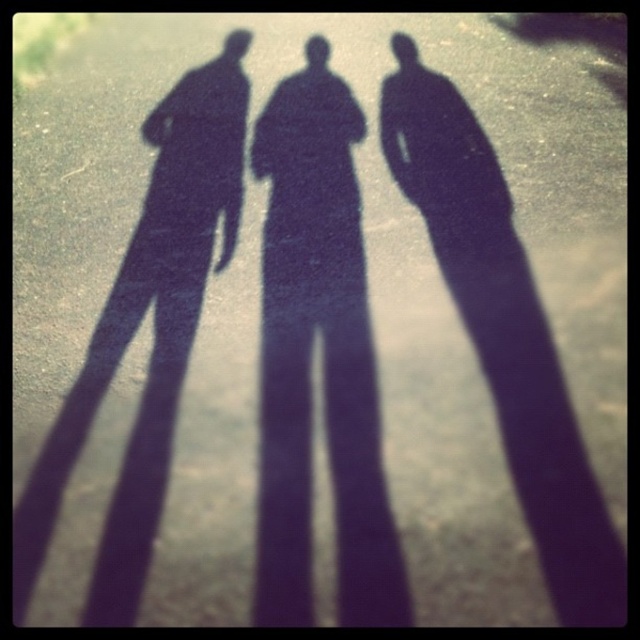
Question: Is black matte shadow of a person at center wider than black matte figure at left?

Choices:
 (A) no
 (B) yes

Answer: (A)

Question: Is black matte figure at center above black matte figure at left?

Choices:
 (A) yes
 (B) no

Answer: (B)

Question: Which of the following is the closest to the observer?

Choices:
 (A) black matte figure at left
 (B) black matte shadow of a person at center

Answer: (A)

Question: Which object is farther from the camera taking this photo?

Choices:
 (A) black matte figure at left
 (B) black matte figure at center

Answer: (B)

Question: Can you confirm if black matte figure at center is positioned to the left of black matte figure at left?

Choices:
 (A) no
 (B) yes

Answer: (A)

Question: Which object is the farthest from the black matte shadow of a person at center?

Choices:
 (A) black matte figure at center
 (B) black matte figure at left

Answer: (B)